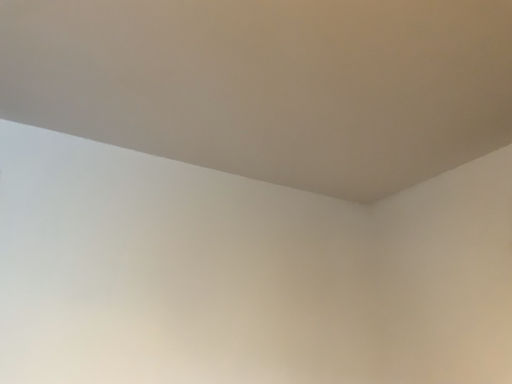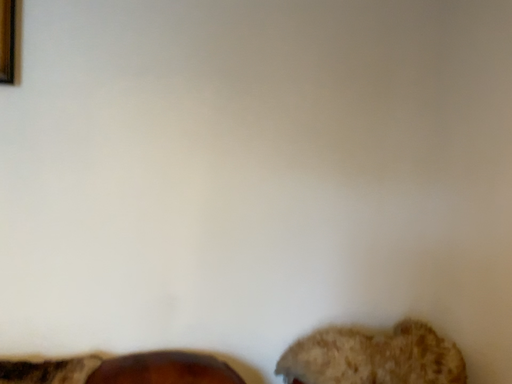
Question: How did the camera likely rotate when shooting the video?

Choices:
 (A) rotated upward
 (B) rotated downward

Answer: (B)